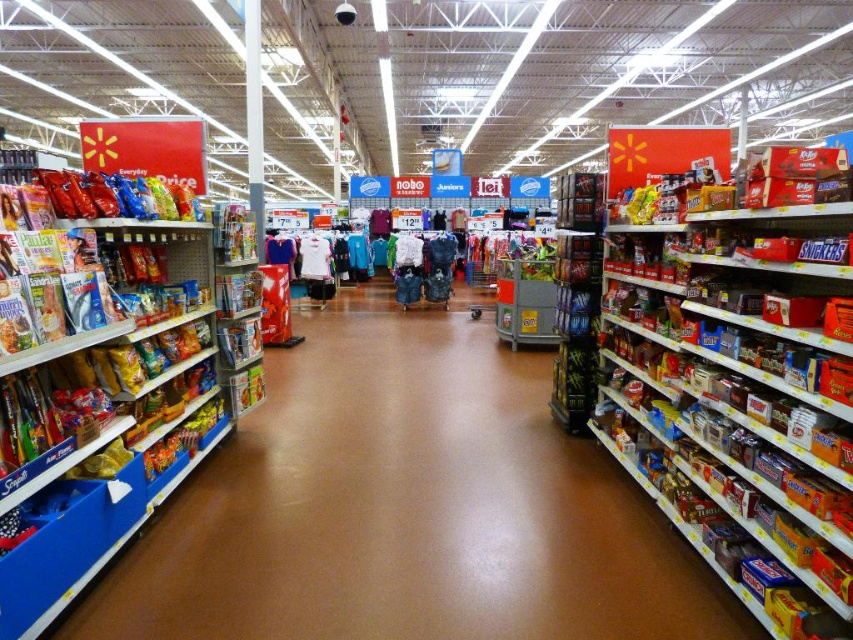
Question: Can you confirm if shiny plastic candy at right is smaller than matte plastic snack packet at left?

Choices:
 (A) yes
 (B) no

Answer: (B)

Question: Does shiny plastic candy at right have a lesser width compared to matte plastic snack packet at left?

Choices:
 (A) yes
 (B) no

Answer: (B)

Question: Is matte plastic snack at left below matte plastic snack packet at left?

Choices:
 (A) no
 (B) yes

Answer: (B)

Question: Which object appears farthest from the camera in this image?

Choices:
 (A) matte plastic snack packet at left
 (B) shiny plastic candy at right
 (C) matte plastic snack at left

Answer: (C)

Question: Which point is closer to the camera?

Choices:
 (A) (96, 209)
 (B) (434, 490)
 (C) (668, 456)

Answer: (A)

Question: Which point is farther to the camera?

Choices:
 (A) shiny plastic candy at right
 (B) matte plastic snack packet at left
 (C) matte plastic snack at left

Answer: (C)